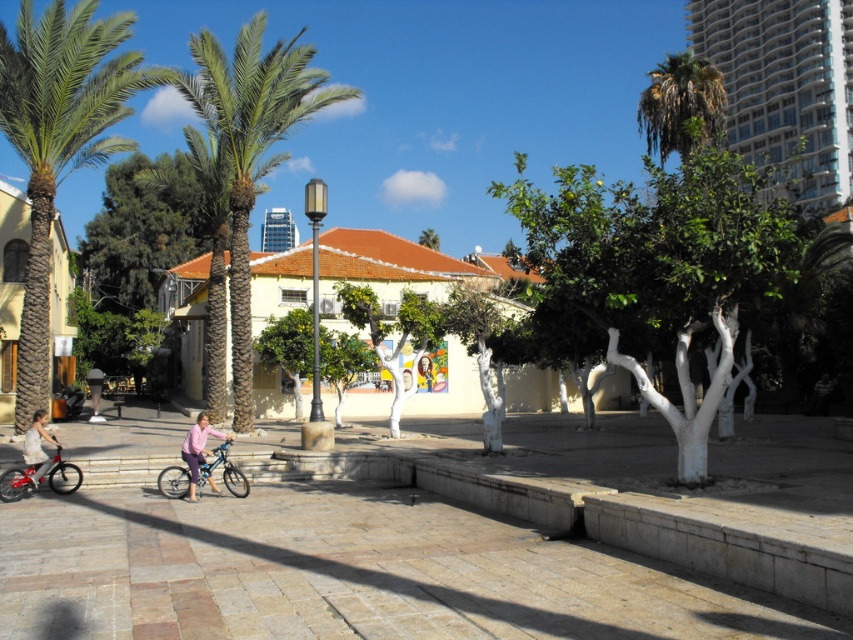
Consider the image. You are standing at the edge of the walkway and see the brick pavement at center and the light pink fabric dress at lower left. Which object is positioned more to the right side of the scene?

The brick pavement at center is positioned more to the right side of the scene compared to the light pink fabric dress at lower left.

You are a gardener who needs to water the green leafy palm tree at left. You have a watering can that can hold 3 liters of water. The brick pavement at center is 2 meters wide. How many trips do you need to make from the water source to the tree if each trip can carry 3 liters and the tree requires 12 liters total?

The brick pavement at center is 2 meters wide, but the question is about the distance between the water source and the tree. The provided information does not specify the distance, so it cannot be determined from the given data.